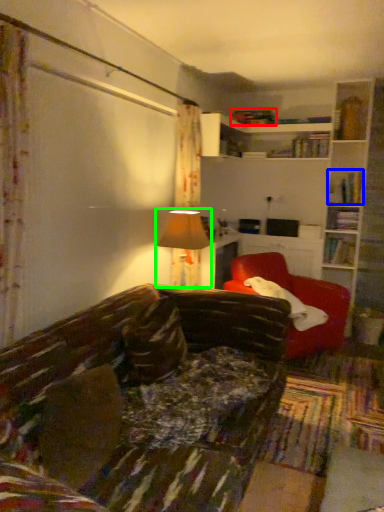
Question: Which object is the closest to the book (highlighted by a red box)? Choose among these: book (highlighted by a blue box) or table lamp (highlighted by a green box).

Choices:
 (A) book
 (B) table lamp

Answer: (A)